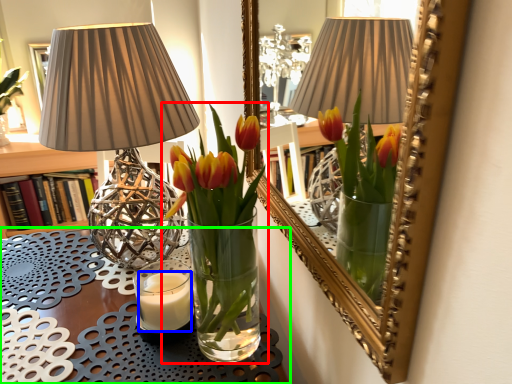
Question: Which is farther away from houseplant (highlighted by a red box)? candle (highlighted by a blue box) or table (highlighted by a green box)?

Choices:
 (A) candle
 (B) table

Answer: (B)